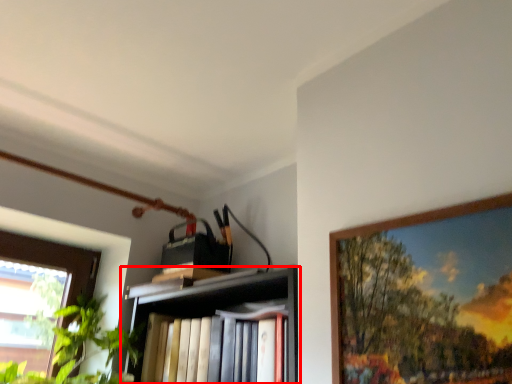
Question: From the image's perspective, what is the correct spatial positioning of shelf (annotated by the red box) in reference to picture frame?

Choices:
 (A) below
 (B) above

Answer: (A)